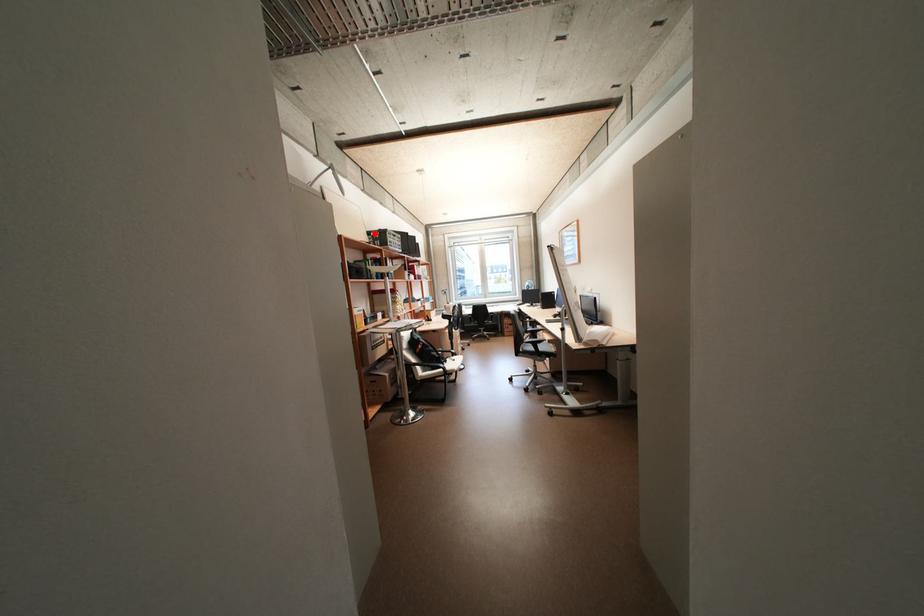
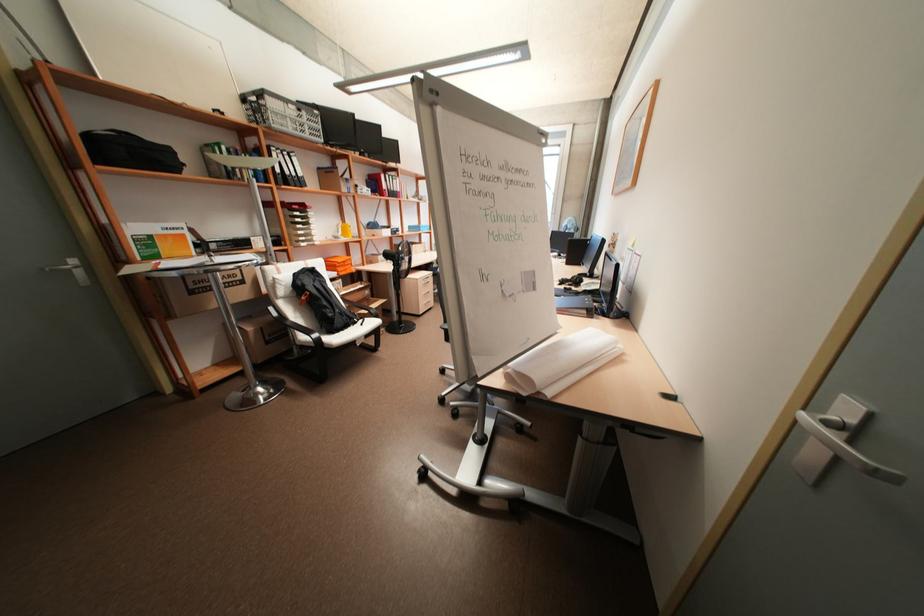
The point at the highlighted location is marked in the first image. Where is the corresponding point in the second image?

(249, 99)